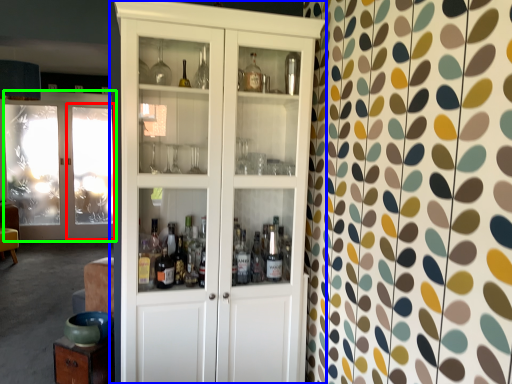
Question: Which object is the farthest from screen door (highlighted by a red box)? Choose among these: cupboard (highlighted by a blue box) or door (highlighted by a green box).

Choices:
 (A) cupboard
 (B) door

Answer: (A)